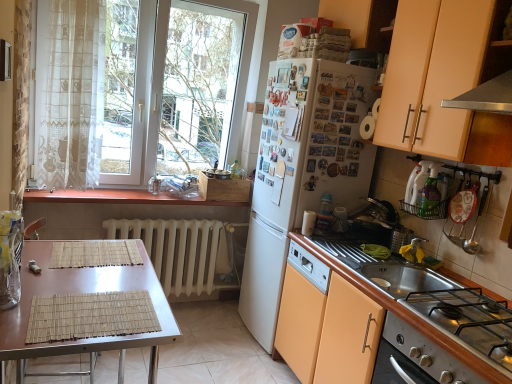
Locate an element on the screen. The image size is (512, 384). free space above brown bamboo placemat at lower left (from a real-world perspective) is located at coordinates (79, 296).